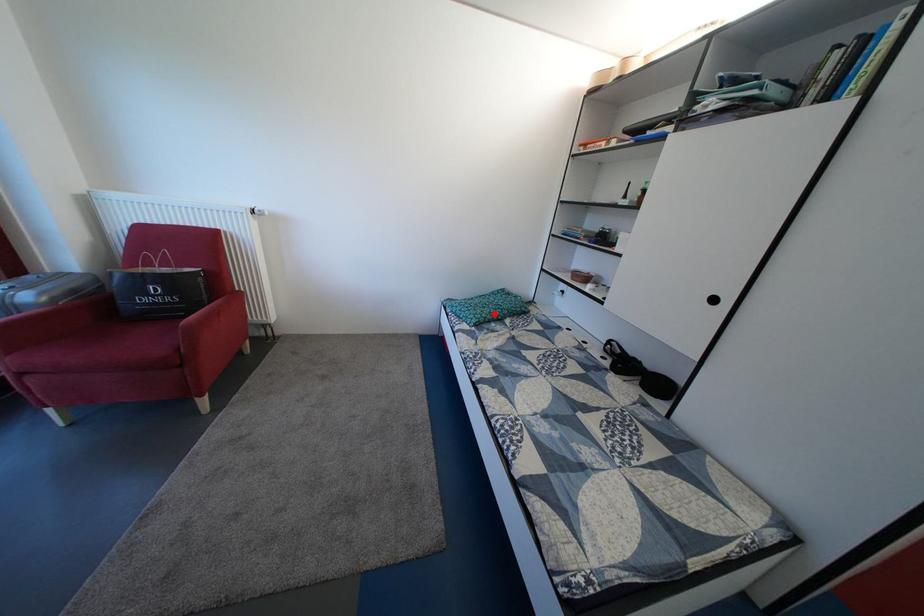
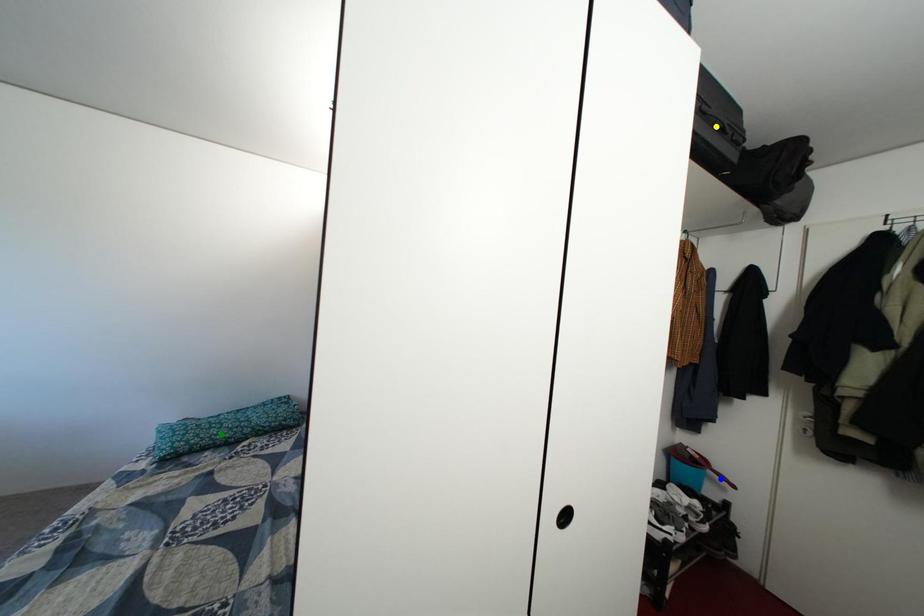
Question: I am providing you with two images of the same scene from different viewpoints. A red point is marked on the first image. You are given multiple points on the second image. Can you choose the point in image 2 that corresponds to the point in image 1?

Choices:
 (A) yellow point
 (B) blue point
 (C) green point

Answer: (C)